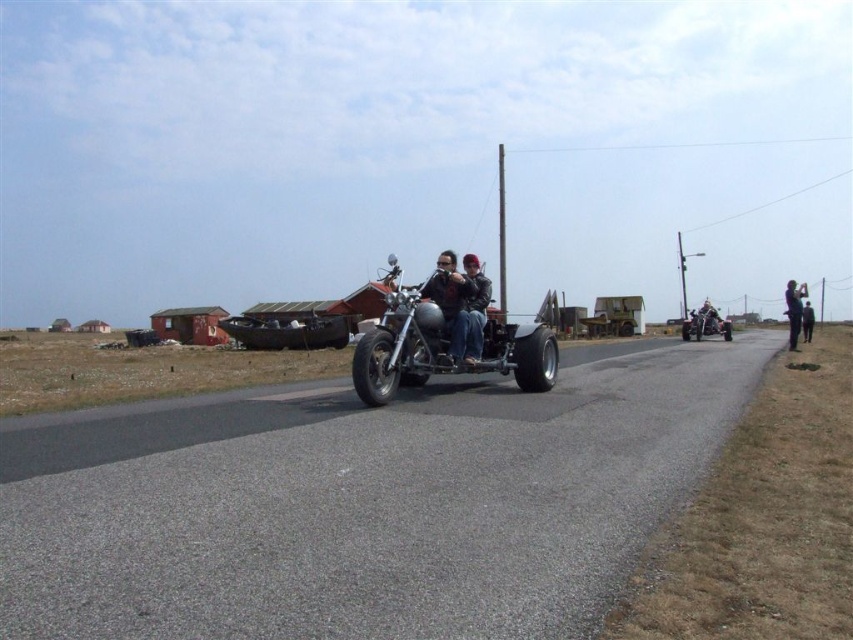
Question: Is shiny chrome motorcycle at right wider than dark gray fabric jacket at right?

Choices:
 (A) no
 (B) yes

Answer: (B)

Question: From the image, what is the correct spatial relationship of rustic wooden sidecar at center in relation to dark gray fabric jacket at right?

Choices:
 (A) below
 (B) above

Answer: (B)

Question: Among these points, which one is farthest from the camera?

Choices:
 (A) (701, 328)
 (B) (792, 333)
 (C) (469, 296)
 (D) (805, 333)

Answer: (A)

Question: Can you confirm if shiny chrome motorcycle at center is positioned below dark gray fabric jacket at right?

Choices:
 (A) no
 (B) yes

Answer: (A)

Question: Estimate the real-world distances between objects in this image. Which object is farther from the dark gray fabric jacket at right?

Choices:
 (A) shiny chrome motorcycle at right
 (B) matte black motorcycle at center
 (C) leather jacket at center

Answer: (B)

Question: Which point is farther to the camera?

Choices:
 (A) dark gray jacket at right
 (B) rustic wooden sidecar at center
 (C) matte black motorcycle at center
 (D) dark gray fabric jacket at right

Answer: (B)